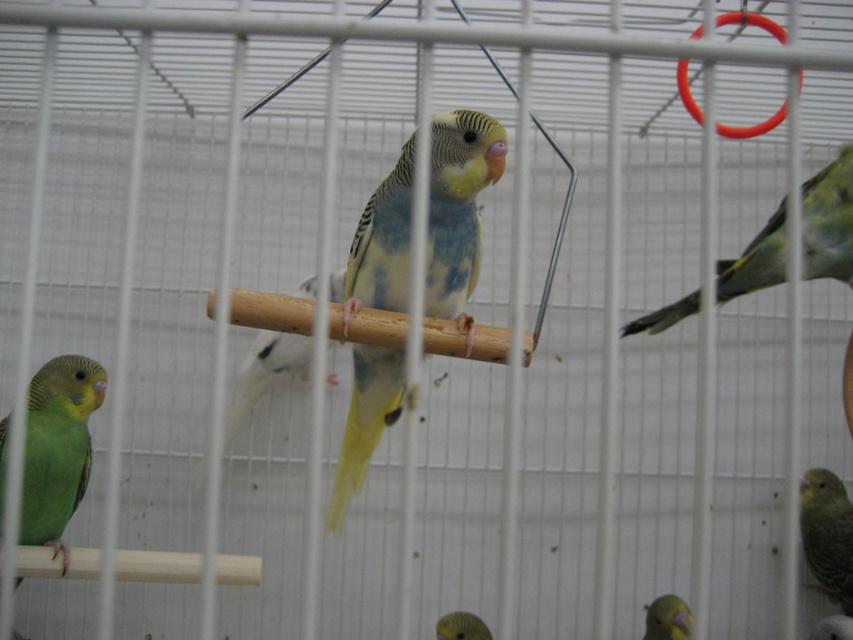
You are standing in front of the cage and notice a point marked at coordinates (457,209). What type of bird is located at that point?

The point at coordinates (457,209) corresponds to a yellow green feathered parrot at center.